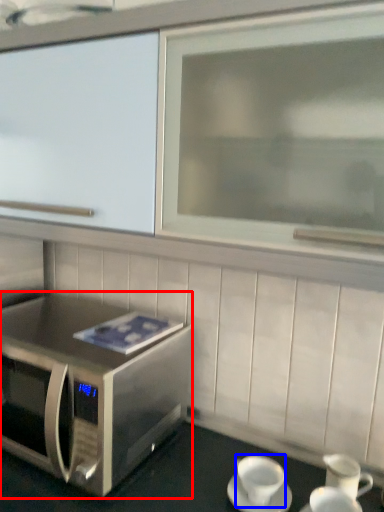
Question: Which object appears closest to the camera in this image, microwave oven (highlighted by a red box) or coffee cup (highlighted by a blue box)?

Choices:
 (A) microwave oven
 (B) coffee cup

Answer: (A)